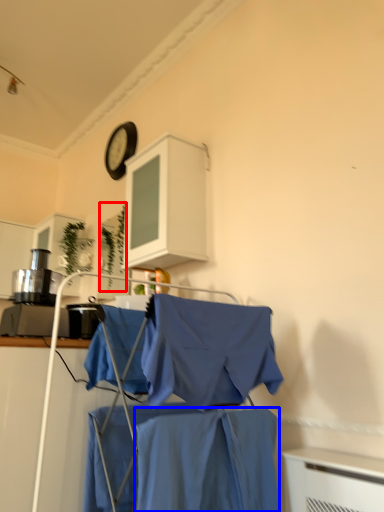
Question: Which object appears farthest to the camera in this image, plant (highlighted by a red box) or fabric (highlighted by a blue box)?

Choices:
 (A) plant
 (B) fabric

Answer: (A)